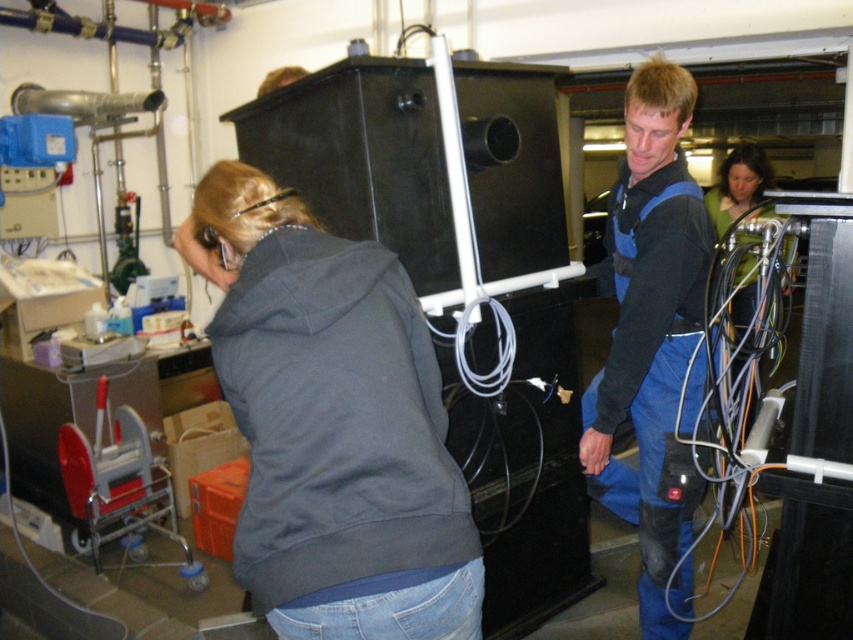
In the scene shown: You are an inspector in this workshop and need to identify clothing items. Which clothing item is located below the other between the dark gray fleece sweatshirt at center and the blue denim coveralls at center?

The dark gray fleece sweatshirt at center is positioned under the blue denim coveralls at center, so it is located below the blue denim coveralls at center.

You are a technician in the workshop and need to reach a tool located at point A and point B. The coordinates for point A are point (421, 541) and point B are point (766, 248). Which point is closer to you?

Point (421, 541) is in front of point (766, 248), so point A is closer to you.

You are a safety inspector in this workshop. You need to ensure that the dark gray fleece sweatshirt at center and the black rubber wires at right are arranged properly. According to safety protocols, thicker items should be placed on lower shelves for stability. Which object should be placed on the lower shelf?

The black rubber wires at right should be placed on the lower shelf because they are thicker than the dark gray fleece sweatshirt at center, meeting safety requirements for stability.